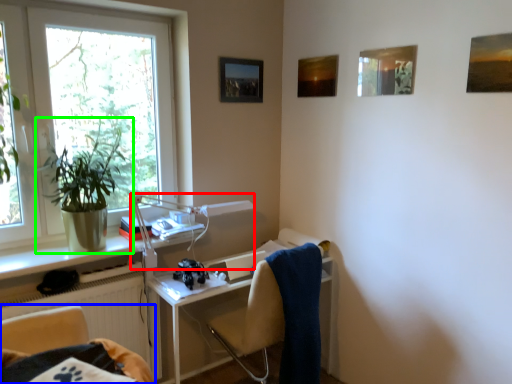
Question: Which object is positioned farthest from equipment (highlighted by a red box)? Select from chair (highlighted by a blue box) and houseplant (highlighted by a green box).

Choices:
 (A) chair
 (B) houseplant

Answer: (A)